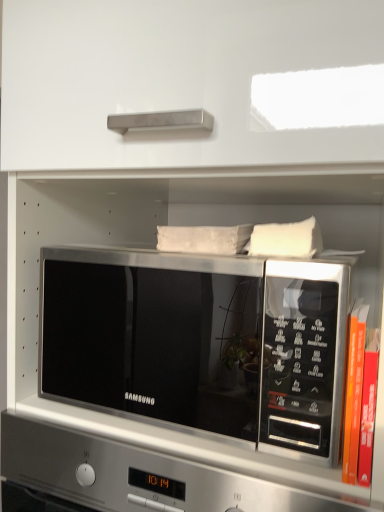
Question: Is white soft pillow at upper right at the right side of orange hardcover book at right?

Choices:
 (A) yes
 (B) no

Answer: (B)

Question: Is the surface of white soft pillow at upper right in direct contact with orange hardcover book at right?

Choices:
 (A) yes
 (B) no

Answer: (B)

Question: Does white soft pillow at upper right turn towards orange hardcover book at right?

Choices:
 (A) no
 (B) yes

Answer: (A)

Question: Considering the relative sizes of white soft pillow at upper right and orange hardcover book at right in the image provided, is white soft pillow at upper right bigger than orange hardcover book at right?

Choices:
 (A) yes
 (B) no

Answer: (A)

Question: Is white soft pillow at upper right completely or partially outside of orange hardcover book at right?

Choices:
 (A) no
 (B) yes

Answer: (B)

Question: Is white soft pillow at upper right facing away from orange hardcover book at right?

Choices:
 (A) yes
 (B) no

Answer: (B)

Question: Considering the relative sizes of satin silver microwave at center and white soft pillow at upper right in the image provided, is satin silver microwave at center smaller than white soft pillow at upper right?

Choices:
 (A) no
 (B) yes

Answer: (A)

Question: Is white soft pillow at upper right a part of satin silver microwave at center?

Choices:
 (A) yes
 (B) no

Answer: (B)

Question: Considering the relative positions of satin silver microwave at center and white soft pillow at upper right in the image provided, is satin silver microwave at center to the left of white soft pillow at upper right from the viewer's perspective?

Choices:
 (A) no
 (B) yes

Answer: (B)

Question: Can you see satin silver microwave at center touching white soft pillow at upper right?

Choices:
 (A) yes
 (B) no

Answer: (B)

Question: Can you confirm if satin silver microwave at center is thinner than white soft pillow at upper right?

Choices:
 (A) no
 (B) yes

Answer: (A)

Question: Is satin silver microwave at center outside white soft pillow at upper right?

Choices:
 (A) no
 (B) yes

Answer: (B)

Question: Is orange hardcover book at right to the right of white soft pillow at upper right from the viewer's perspective?

Choices:
 (A) yes
 (B) no

Answer: (A)